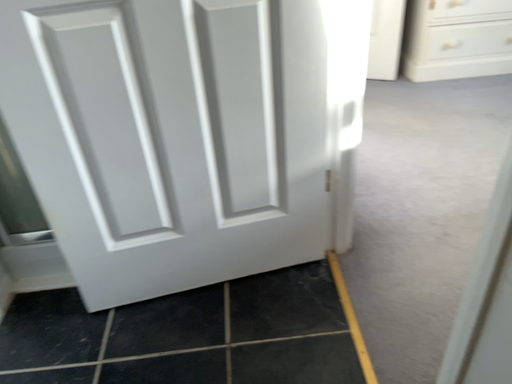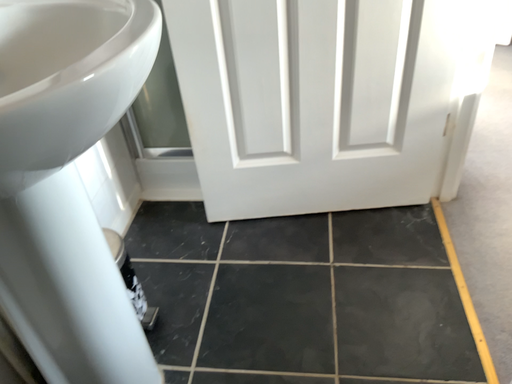
Question: Which way did the camera rotate in the video?

Choices:
 (A) rotated left
 (B) rotated right

Answer: (A)